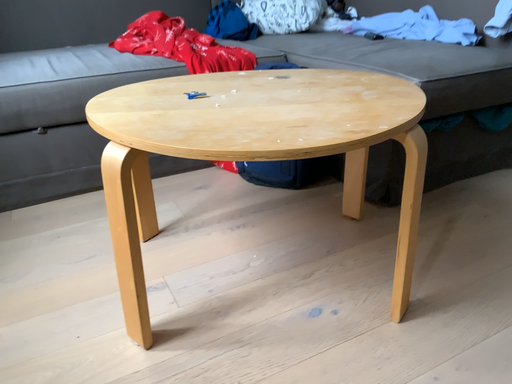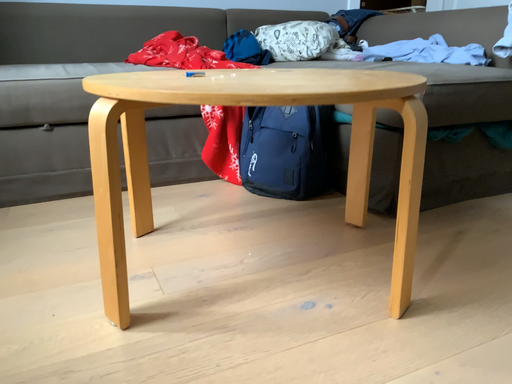
Question: How did the camera likely rotate when shooting the video?

Choices:
 (A) rotated upward
 (B) rotated downward

Answer: (A)